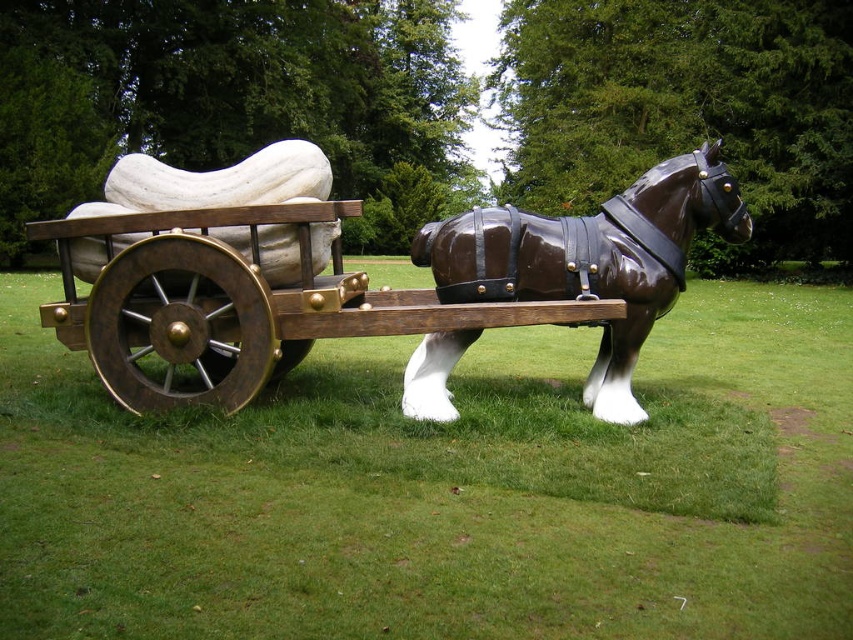
Question: Which of the following is the closest to the observer?

Choices:
 (A) (126, 323)
 (B) (498, 252)

Answer: (B)

Question: Considering the relative positions of green grass at lower center and wooden polished wheel at center-left in the image provided, where is green grass at lower center located with respect to wooden polished wheel at center-left?

Choices:
 (A) right
 (B) left

Answer: (A)

Question: Which object is the farthest from the green grass at lower center?

Choices:
 (A) shiny brown wood cart at center
 (B) brass metallic wheel at lower left

Answer: (B)

Question: Does green grass at lower center appear on the left side of shiny brown horse at center?

Choices:
 (A) no
 (B) yes

Answer: (B)

Question: Which object is positioned closest to the shiny brown horse at center?

Choices:
 (A) green grass at lower center
 (B) brass metallic wheel at lower left

Answer: (A)

Question: Does shiny brown wood cart at center have a lesser width compared to shiny brown horse at center?

Choices:
 (A) no
 (B) yes

Answer: (A)